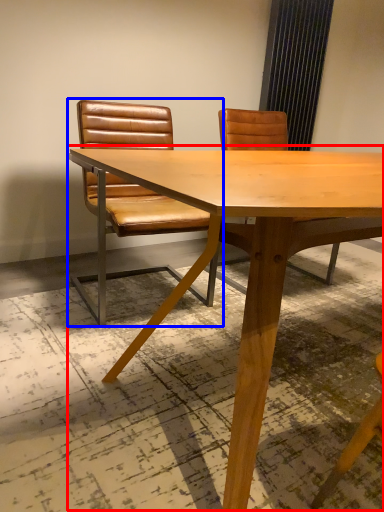
Question: Which point is closer to the camera, table (highlighted by a red box) or chair (highlighted by a blue box)?

Choices:
 (A) table
 (B) chair

Answer: (A)